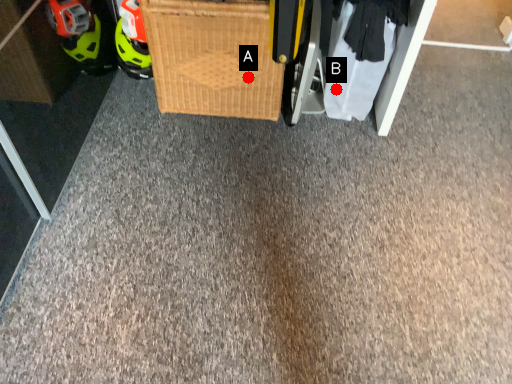
Question: Two points are circled on the image, labeled by A and B beside each circle. Among these points, which one is nearest to the camera?

Choices:
 (A) A is closer
 (B) B is closer

Answer: (A)